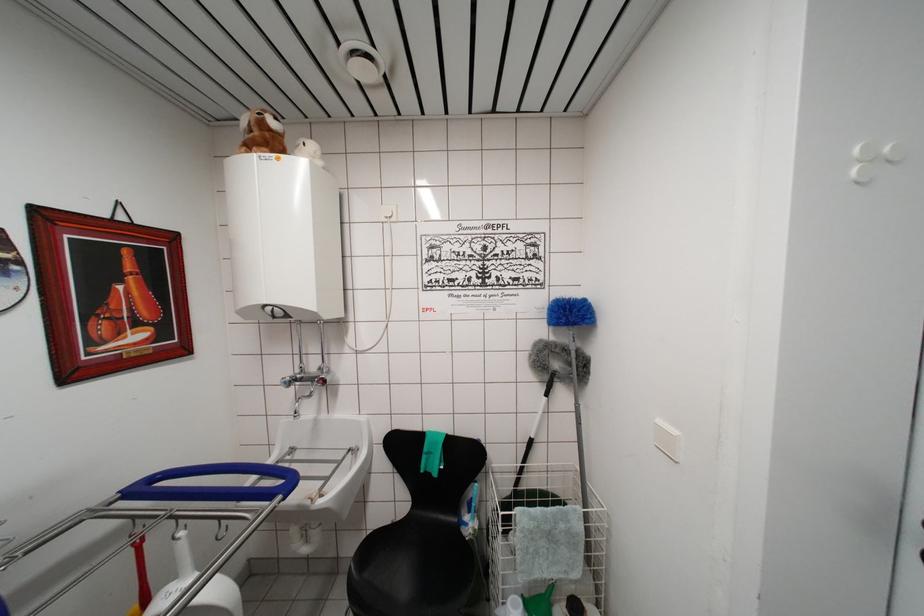
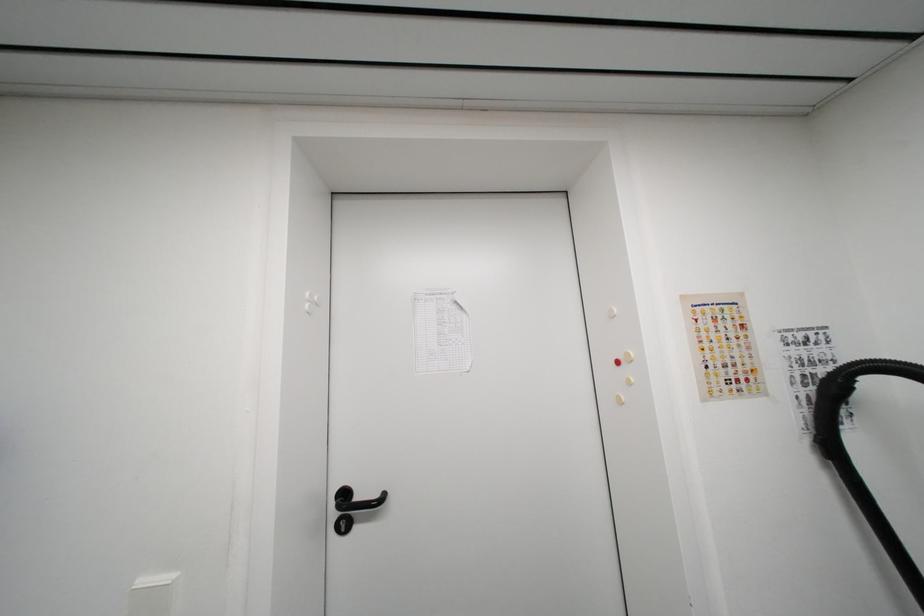
Question: Based on the continuous images, in which direction is the camera rotating? Reply with the corresponding letter.

Choices:
 (A) Left
 (B) Right
 (C) Up
 (D) Down

Answer: (B)